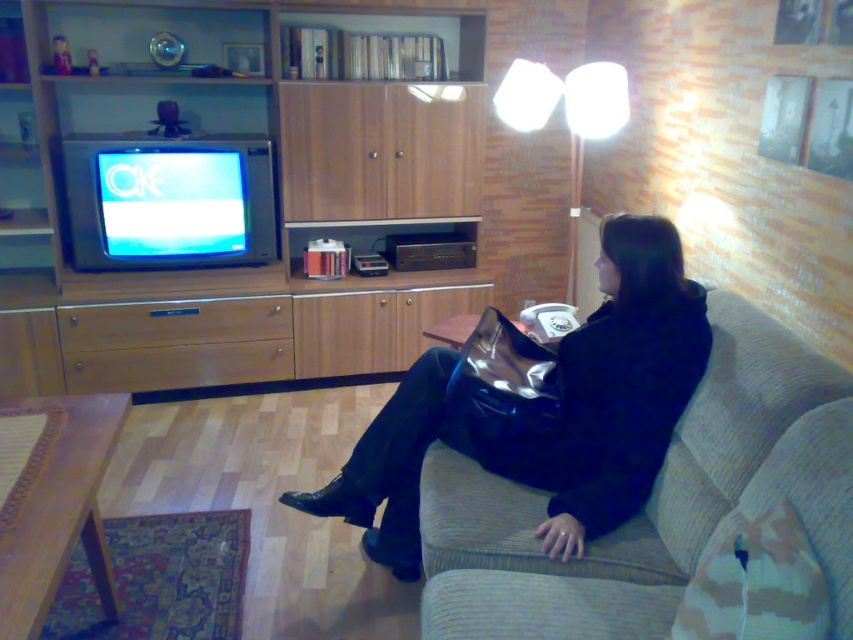
Can you confirm if textured gray couch at right is bigger than white fabric lamp at upper center?

Incorrect, textured gray couch at right is not larger than white fabric lamp at upper center.

Is textured gray couch at right behind white fabric lamp at upper center?

No, it is in front of white fabric lamp at upper center.

Is point (769, 333) positioned after point (578, 214)?

No, it is in front of (578, 214).

This screenshot has width=853, height=640. Identify the location of textured gray couch at right. (653, 500).

Who is more distant from viewer, (386,212) or (474,624)?

The point (386,212) is behind.

The height and width of the screenshot is (640, 853). What do you see at coordinates (276, 220) in the screenshot?
I see `brown wood entertainment center at left` at bounding box center [276, 220].

Is point (198, 129) closer to viewer compared to point (781, 458)?

No.

Image resolution: width=853 pixels, height=640 pixels. Identify the location of brown wood entertainment center at left. (276, 220).

Is brown wood entertainment center at left smaller than white fabric lamp at upper center?

Incorrect, brown wood entertainment center at left is not smaller in size than white fabric lamp at upper center.

Which is in front, point (300, 282) or point (498, 99)?

Point (498, 99)

This screenshot has height=640, width=853. What are the coordinates of `brown wood entertainment center at left` in the screenshot? It's located at (276, 220).